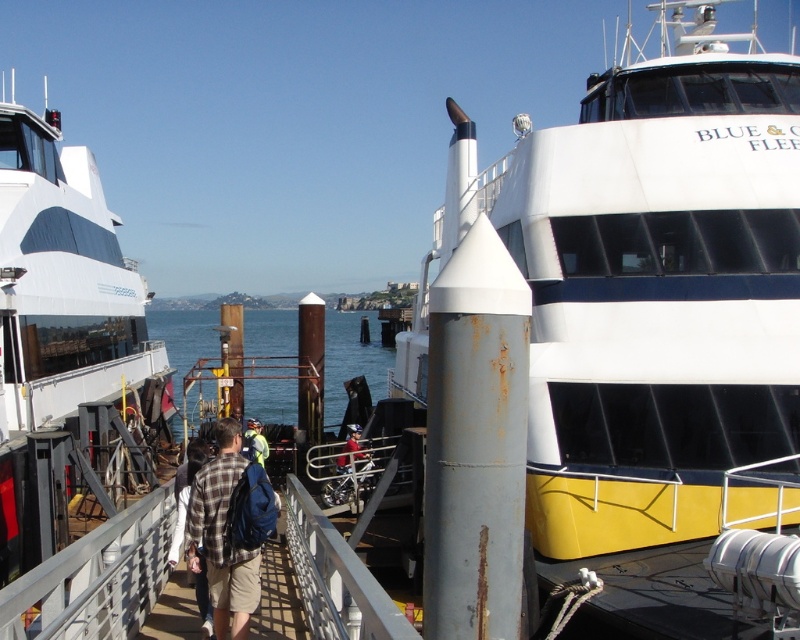
Question: Does plaid fabric shirt at center appear under plaid shirt at center?

Choices:
 (A) no
 (B) yes

Answer: (A)

Question: Which of these objects is positioned farthest from the plaid fabric shirt at center?

Choices:
 (A) white matte boat at center
 (B) blue water at center
 (C) plaid shirt at center
 (D) white matte boat at left

Answer: (B)

Question: Which object appears closest to the camera in this image?

Choices:
 (A) white matte boat at center
 (B) blue water at center

Answer: (A)

Question: Can you confirm if white matte boat at left is thinner than plaid fabric shirt at center?

Choices:
 (A) yes
 (B) no

Answer: (B)

Question: Does white matte boat at center appear on the right side of plaid shirt at center?

Choices:
 (A) no
 (B) yes

Answer: (B)

Question: Among these objects, which one is nearest to the camera?

Choices:
 (A) white matte boat at left
 (B) plaid fabric shirt at center

Answer: (A)